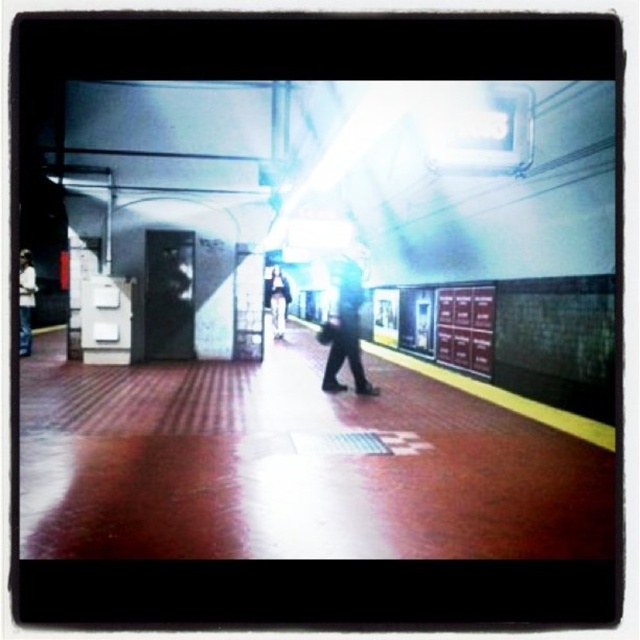
You are standing at the entrance of the subway station platform and want to locate the matte black jacket at left. According to the coordinates given, where would you look to find it?

The matte black jacket at left is located at coordinates point (26, 300), which means it is positioned near the lower left area of the platform.

You are standing on the subway station platform and notice a person wearing dark gray pants at center. Can you determine their exact position relative to the platform using coordinates?

The dark gray pants at center is located at point (346, 333), which indicates their precise position on the platform.